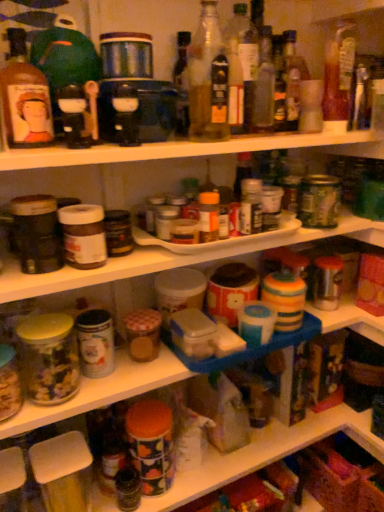
Question: Considering the relative positions of translucent glass jar at left and matte glass bottle at upper left, placed as the first bottle when sorted from left to right, in the image provided, is translucent glass jar at left to the left of matte glass bottle at upper left, placed as the first bottle when sorted from left to right, from the viewer's perspective?

Choices:
 (A) no
 (B) yes

Answer: (A)

Question: Is translucent glass jar at left at the right side of matte glass bottle at upper left, placed as the first bottle when sorted from left to right?

Choices:
 (A) no
 (B) yes

Answer: (B)

Question: From the image's perspective, would you say translucent glass jar at left is positioned over matte glass bottle at upper left, the 6th bottle in the right-to-left sequence?

Choices:
 (A) yes
 (B) no

Answer: (B)

Question: From a real-world perspective, is translucent glass jar at left on matte glass bottle at upper left, the 6th bottle in the right-to-left sequence?

Choices:
 (A) no
 (B) yes

Answer: (A)

Question: Is translucent glass jar at left outside of matte glass bottle at upper left, the 6th bottle in the right-to-left sequence?

Choices:
 (A) no
 (B) yes

Answer: (B)

Question: From the image's perspective, is matte glass bottle at upper left, placed as the first bottle when sorted from left to right, positioned above or below translucent glass bottle at upper center, which is the second bottle in right-to-left order?

Choices:
 (A) below
 (B) above

Answer: (A)

Question: Is matte glass bottle at upper left, the 6th bottle in the right-to-left sequence, wider or thinner than translucent glass bottle at upper center, acting as the fifth bottle starting from the left?

Choices:
 (A) thin
 (B) wide

Answer: (B)

Question: From a real-world perspective, is matte glass bottle at upper left, placed as the first bottle when sorted from left to right, positioned above or below translucent glass bottle at upper center, which is the second bottle in right-to-left order?

Choices:
 (A) below
 (B) above

Answer: (B)

Question: In terms of height, does matte glass bottle at upper left, the 6th bottle in the right-to-left sequence, look taller or shorter compared to translucent glass bottle at upper center, acting as the fifth bottle starting from the left?

Choices:
 (A) short
 (B) tall

Answer: (A)

Question: Is translucent glass bottle at upper center, placed as the second bottle when sorted from left to right, inside or outside of translucent glass bottle at center, which is the fourth bottle from left to right?

Choices:
 (A) outside
 (B) inside

Answer: (A)

Question: Based on their positions, is translucent glass bottle at upper center, placed as the second bottle when sorted from left to right, located to the left or right of translucent glass bottle at center, placed as the third bottle when sorted from right to left?

Choices:
 (A) right
 (B) left

Answer: (B)

Question: Considering the positions of translucent glass bottle at upper center, the 5th bottle viewed from the right, and translucent glass bottle at center, which is the fourth bottle from left to right, in the image, is translucent glass bottle at upper center, the 5th bottle viewed from the right, bigger or smaller than translucent glass bottle at center, which is the fourth bottle from left to right,?

Choices:
 (A) big
 (B) small

Answer: (A)

Question: Relative to translucent glass bottle at center, which is the fourth bottle from left to right, is translucent glass bottle at upper center, the 5th bottle viewed from the right, in front or behind?

Choices:
 (A) behind
 (B) front

Answer: (B)

Question: From the image's perspective, is translucent glass bottle at upper right, the sixth bottle when ordered from left to right, located above or below translucent glass bottle at upper center, the third bottle in the left-to-right sequence?

Choices:
 (A) below
 (B) above

Answer: (B)

Question: Is translucent glass bottle at upper right, the sixth bottle when ordered from left to right, inside the boundaries of translucent glass bottle at upper center, the third bottle in the left-to-right sequence, or outside?

Choices:
 (A) inside
 (B) outside

Answer: (B)